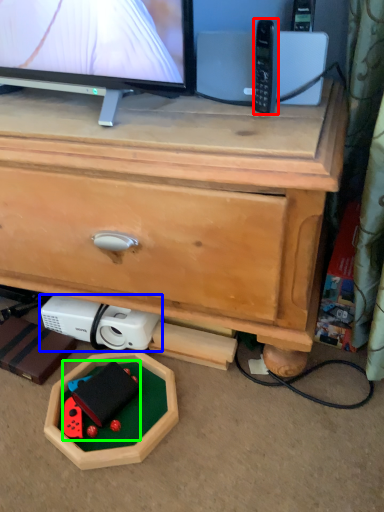
Question: Estimate the real-world distances between objects in this image. Which object is farther from control (highlighted by a red box), appliance (highlighted by a blue box) or toy (highlighted by a green box)?

Choices:
 (A) appliance
 (B) toy

Answer: (B)